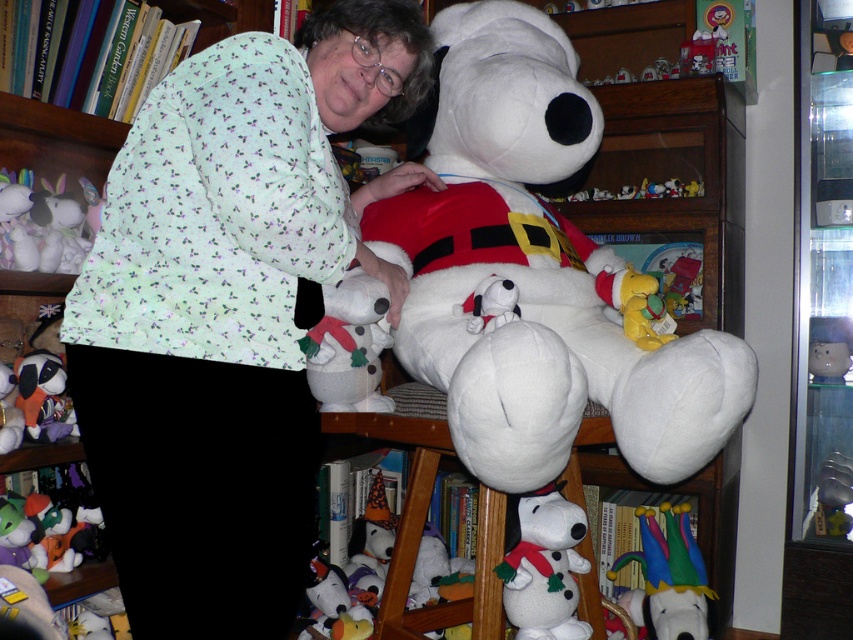
Does point (201, 509) come in front of point (837, 378)?

Yes, point (201, 509) is closer to viewer.

Between point (90, 397) and point (834, 348), which one is positioned in front?

Point (90, 397) is more forward.

This screenshot has height=640, width=853. In order to click on light green printed fabric at center in this screenshot , I will do `click(229, 310)`.

Is white plush bear at center positioned before fluffy white bunny at left?

Yes, white plush bear at center is in front of fluffy white bunny at left.

Which of these two, white plush bear at center or fluffy white bunny at left, stands taller?

white plush bear at center

Image resolution: width=853 pixels, height=640 pixels. I want to click on white plush bear at center, so (534, 273).

Which of these two, multicolored felt jester hat at lower right or velvet plush dog at lower left, stands taller?

With more height is multicolored felt jester hat at lower right.

Is multicolored felt jester hat at lower right below velvet plush dog at lower left?

Correct, multicolored felt jester hat at lower right is located below velvet plush dog at lower left.

Is point (664, 602) positioned after point (53, 378)?

Yes, point (664, 602) is behind point (53, 378).

This screenshot has height=640, width=853. I want to click on multicolored felt jester hat at lower right, so click(668, 577).